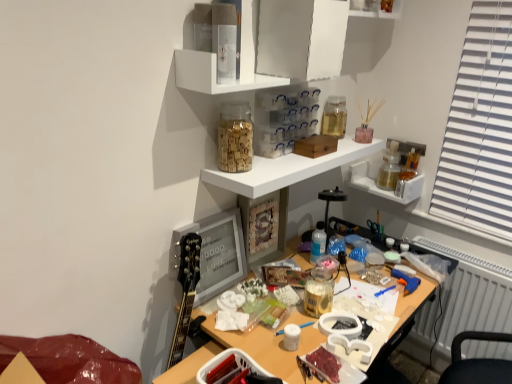
Question: From a real-world perspective, is translucent plastic bottle at center positioned above or below transparent glass jar at upper center, the fourth shelf ordered from the bottom?

Choices:
 (A) below
 (B) above

Answer: (A)

Question: In terms of size, does translucent plastic bottle at center appear bigger or smaller than transparent glass jar at upper center, positioned as the first shelf in top-to-bottom order?

Choices:
 (A) big
 (B) small

Answer: (B)

Question: Based on their relative distances, which object is nearer to the white glossy shelf at upper center, the third shelf from the bottom?

Choices:
 (A) metallic gold jar at upper right, the 4th shelf in the top-to-bottom sequence
 (B) wooden alphabet blocks at upper center, arranged as the first stationery when viewed from the left
 (C) transparent glass jar at upper center, the fourth shelf ordered from the bottom
 (D) white matte jar at center, the first stationery from the front
 (E) white plastic radiator at lower right

Answer: (B)

Question: Which object is positioned farthest from the translucent plastic bottle at center?

Choices:
 (A) blue plastic paint brush at center
 (B) metallic gold jar at upper right, the 4th shelf in the top-to-bottom sequence
 (C) wooden alphabet blocks at upper center, which appears as the second stationery when viewed from the top
 (D) translucent glass jar at upper center, the 1th stationery in the back-to-front sequence
 (E) white plastic radiator at lower right

Answer: (E)